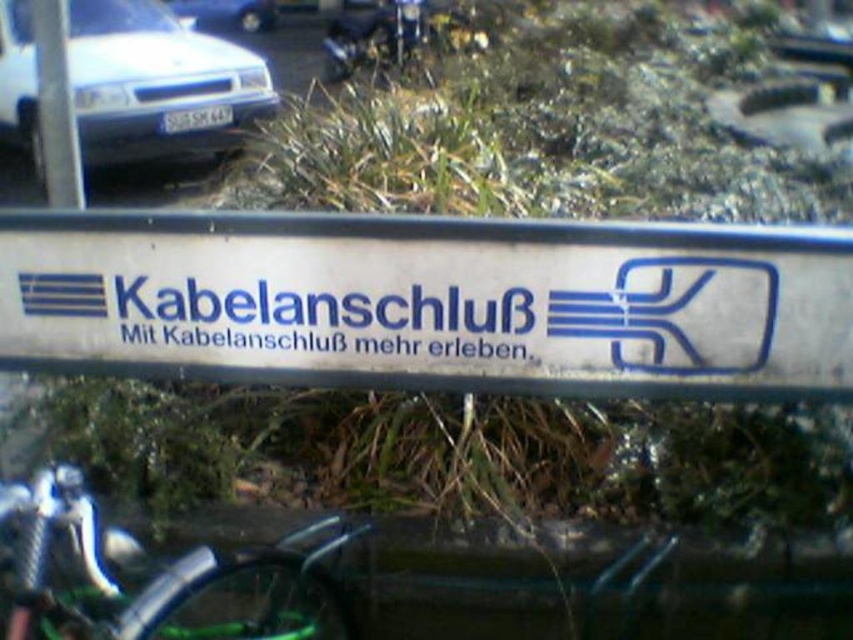
Who is higher up, white metallic sign at center or white glossy car at upper left?

white glossy car at upper left

Does white metallic sign at center have a smaller size compared to white glossy car at upper left?

Yes, white metallic sign at center is smaller than white glossy car at upper left.

Find the location of a particular element. The image size is (853, 640). white metallic sign at center is located at coordinates point(431,301).

Does metallic pole at upper left have a greater height compared to white glossy car at upper left?

No, metallic pole at upper left is not taller than white glossy car at upper left.

Who is more distant from viewer, (51, 106) or (196, 20)?

The point (196, 20) is more distant.

Image resolution: width=853 pixels, height=640 pixels. What do you see at coordinates (56, 106) in the screenshot? I see `metallic pole at upper left` at bounding box center [56, 106].

Identify the location of metallic pole at upper left. (56, 106).

Can you confirm if white matte car at upper left is positioned above shiny metallic bicycle handlebar at lower left?

Correct, white matte car at upper left is located above shiny metallic bicycle handlebar at lower left.

Is white matte car at upper left positioned before shiny metallic bicycle handlebar at lower left?

That is False.

Where is `white matte car at upper left`? white matte car at upper left is located at coordinates (157, 83).